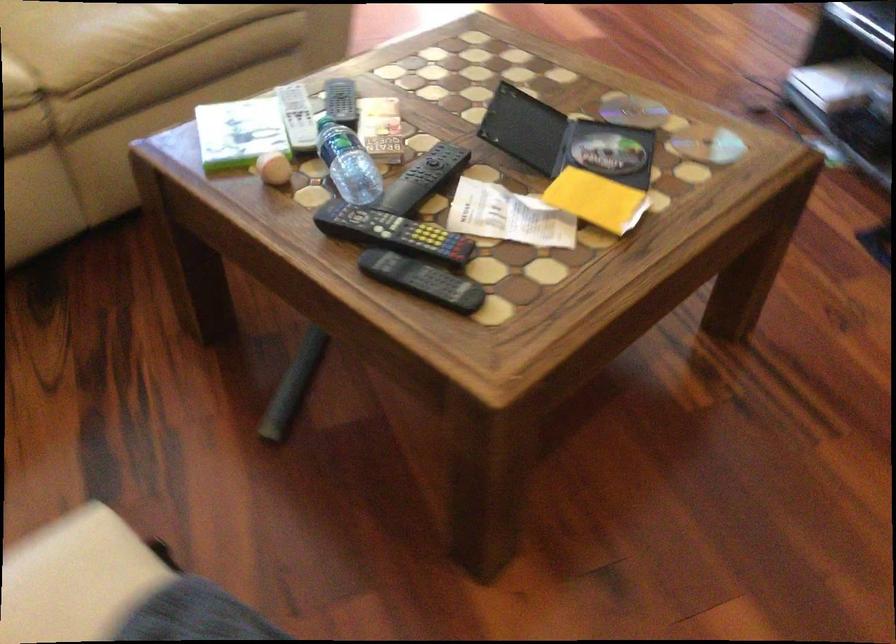
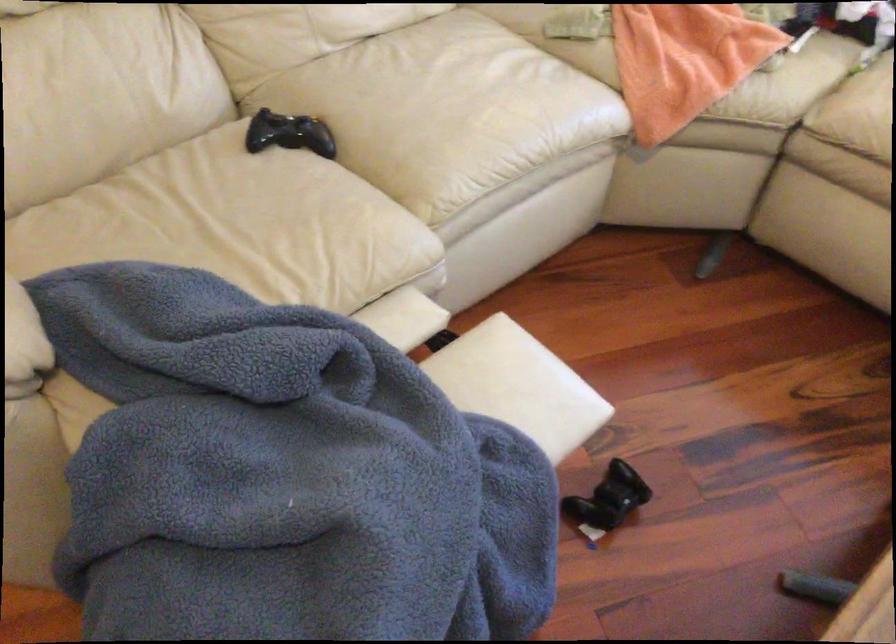
First-person continuous shooting, in which direction is the camera rotating?

The rotation direction of the camera is left-down.